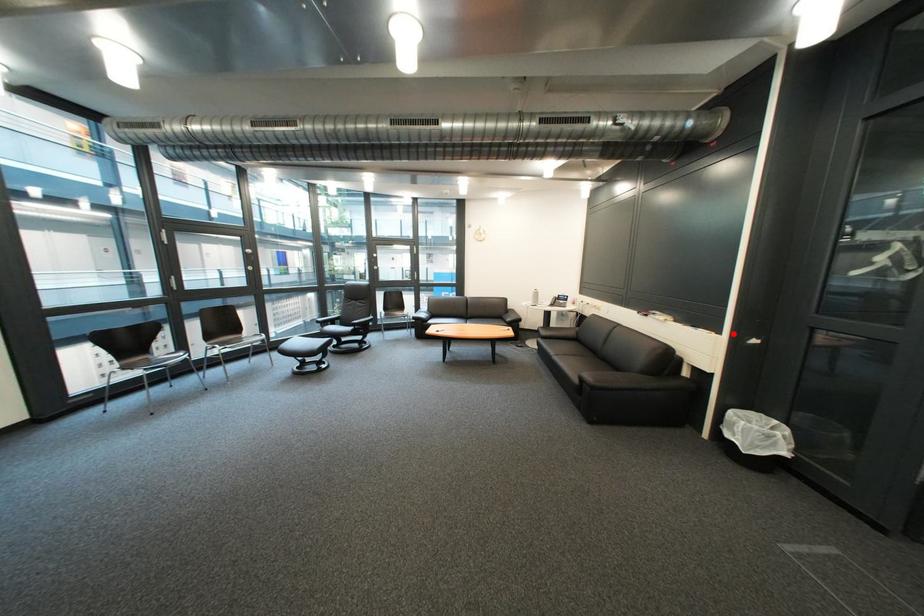
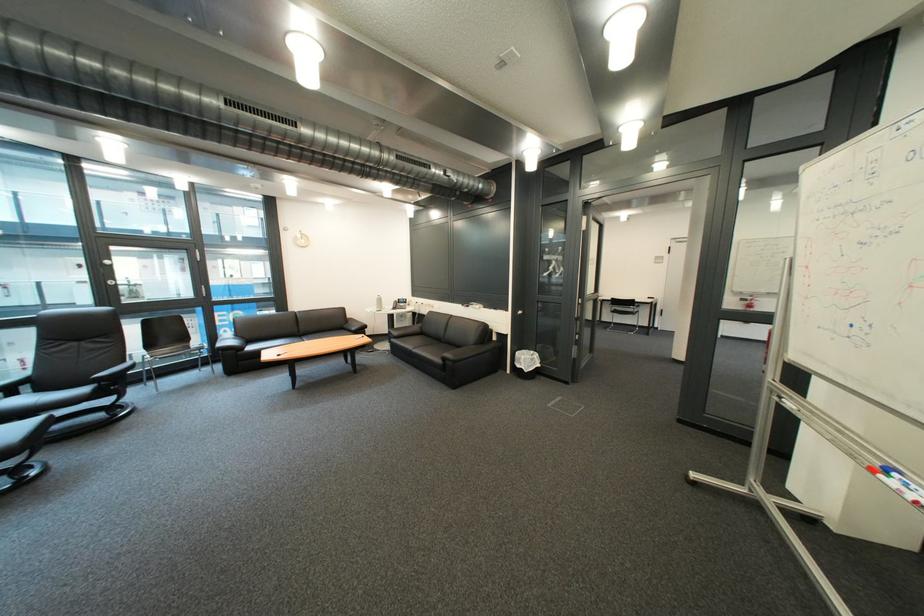
The point at the highlighted location is marked in the first image. Where is the corresponding point in the second image?

(520, 312)